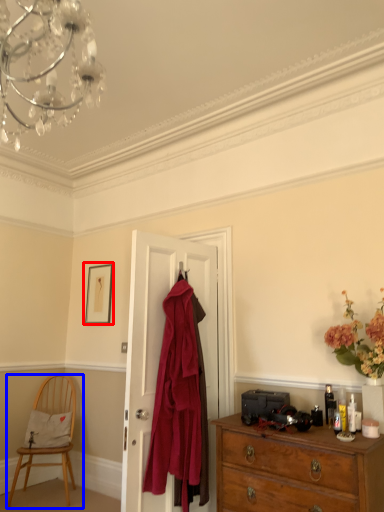
Question: Which of the following is the closest to the observer, picture frame (highlighted by a red box) or chair (highlighted by a blue box)?

Choices:
 (A) picture frame
 (B) chair

Answer: (B)